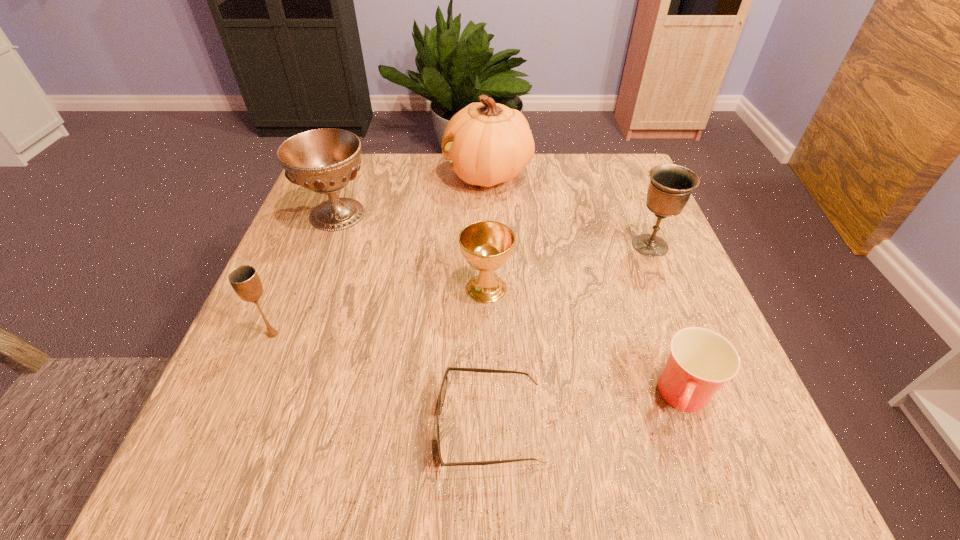
Where is `pumpkin`? pumpkin is located at coordinates (x=487, y=143).

This screenshot has width=960, height=540. Find the location of `the rightmost chalice`. the rightmost chalice is located at coordinates (670, 187).

The height and width of the screenshot is (540, 960). Find the location of `the third nearest object`. the third nearest object is located at coordinates (245, 281).

Image resolution: width=960 pixels, height=540 pixels. Identify the location of the second nearest chalice. (486, 245).

Where is `the third chalice from left to right`? The image size is (960, 540). the third chalice from left to right is located at coordinates (486, 245).

Locate an element on the screen. the second shortest object is located at coordinates (700, 361).

I want to click on sunglasses, so click(443, 389).

You are a GUI agent. You are given a task and a screenshot of the screen. Output one action in this format:
    pyautogui.click(x=<x>, y=<y>)
    Task: Click on the vacant space located on the front face of the tallest object
    The image size is (960, 540).
    Given the screenshot: What is the action you would take?
    pyautogui.click(x=336, y=174)

Find the location of a particular element. The image size is (960, 540). vacant region located 0.210m on the front face of the tallest object is located at coordinates (363, 174).

I want to click on free location located on the front face of the tallest object, so click(x=328, y=174).